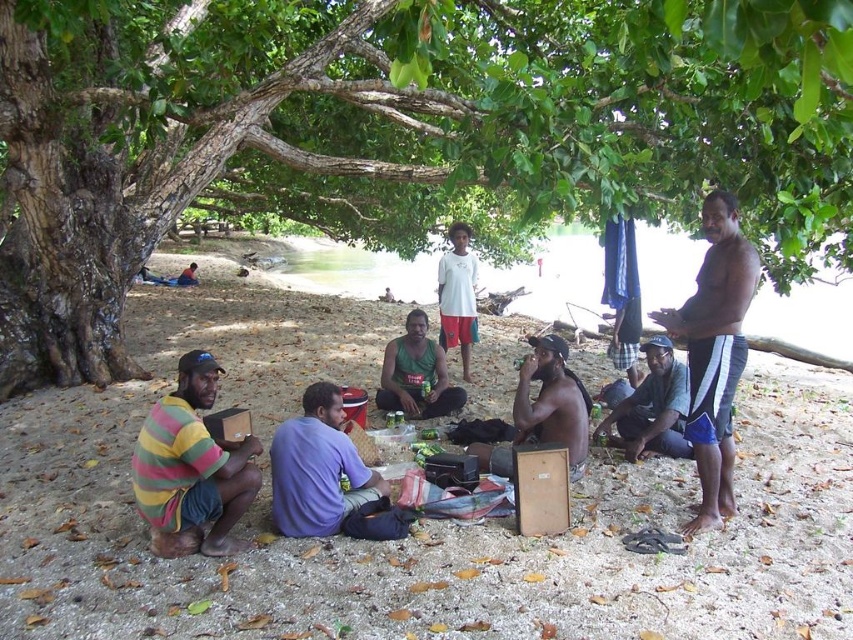
Does brown sand at lower center come behind matte black cap at lower right?

No, brown sand at lower center is closer to the viewer.

Can you confirm if brown sand at lower center is positioned to the right of matte black cap at lower right?

In fact, brown sand at lower center is to the left of matte black cap at lower right.

Measure the distance between point (148,348) and camera.

31.38 feet

Image resolution: width=853 pixels, height=640 pixels. I want to click on brown sand at lower center, so click(415, 524).

How much distance is there between green leafy tree at center and striped cotton shirt at lower left?

4.73 meters

Between point (753, 81) and point (216, 513), which one is positioned in front?

Point (753, 81) is in front.

Does point (517, 170) come in front of point (202, 456)?

No, (517, 170) is further to viewer.

At what (x,y) coordinates should I click in order to perform the action: click on green leafy tree at center. Please return your answer as a coordinate pair (x, y). Looking at the image, I should click on (x=397, y=132).

Is brown skin at right further to camera compared to purple fabric shirt at center?

That is False.

Is point (709, 444) in front of point (300, 452)?

No, (709, 444) is behind (300, 452).

What do you see at coordinates (714, 352) in the screenshot? I see `brown skin at right` at bounding box center [714, 352].

At what (x,y) coordinates should I click in order to perform the action: click on brown skin at right. Please return your answer as a coordinate pair (x, y). Looking at the image, I should click on (714, 352).